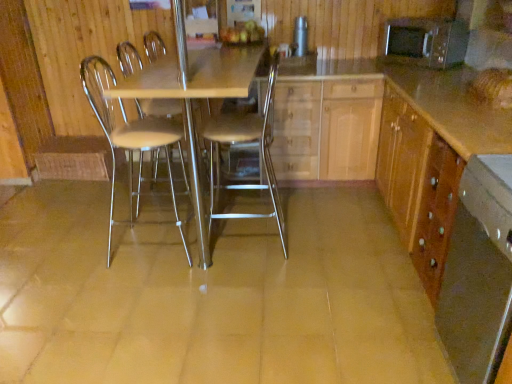
Find the location of `empty space that is in between metallic silver chair at center, the 2th chair when ordered from right to left, and metallic/transparent table at center`. empty space that is in between metallic silver chair at center, the 2th chair when ordered from right to left, and metallic/transparent table at center is located at coordinates (152, 222).